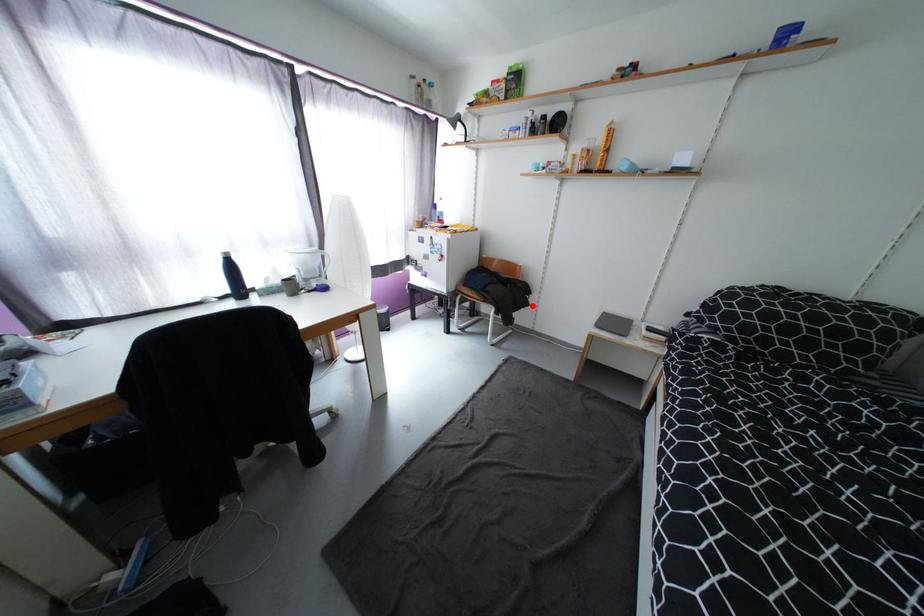
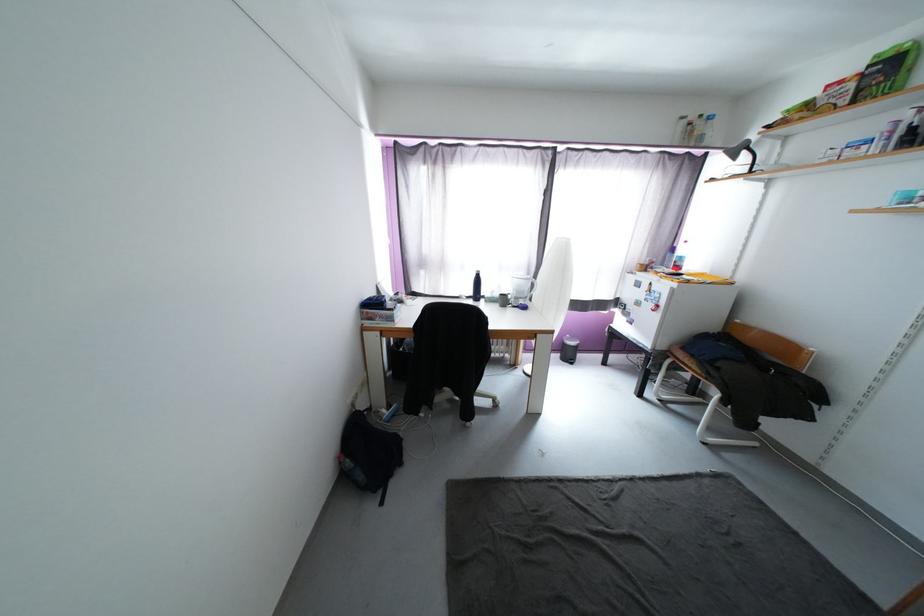
Question: I am providing you with two images of the same scene from different viewpoints. A red point is marked on the first image. Can you still see the location of the red point in image 2?

Choices:
 (A) Yes
 (B) No

Answer: (A)